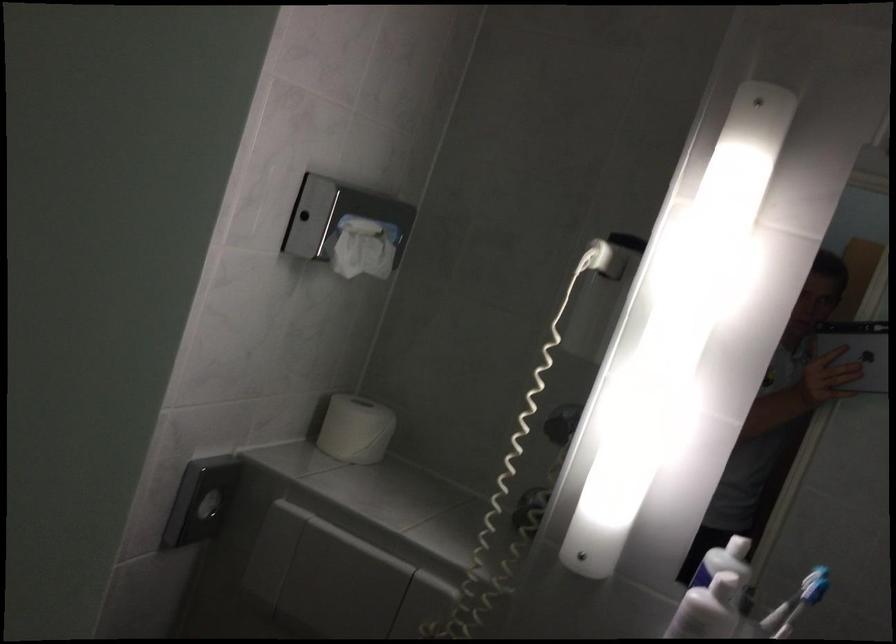
The height and width of the screenshot is (644, 896). What do you see at coordinates (208, 506) in the screenshot?
I see `the silver flush button` at bounding box center [208, 506].